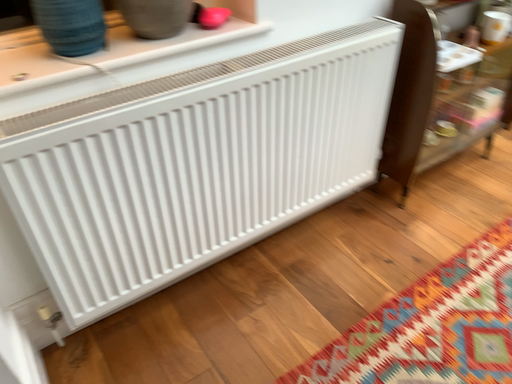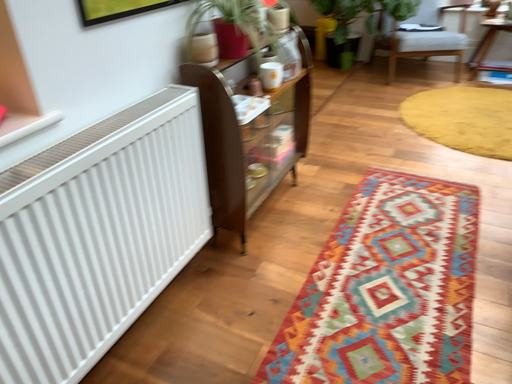
Question: Which way did the camera rotate in the video?

Choices:
 (A) rotated left
 (B) rotated right

Answer: (B)